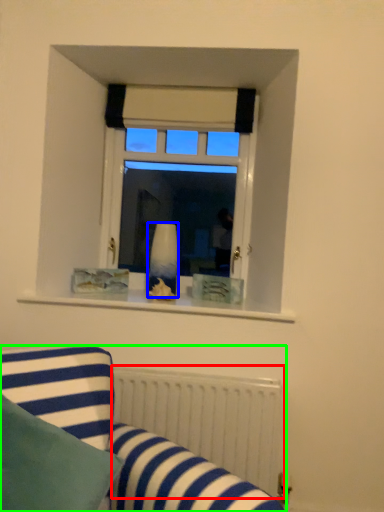
Question: Which is nearer to the radiator (highlighted by a red box)? vase (highlighted by a blue box) or studio couch (highlighted by a green box).

Choices:
 (A) vase
 (B) studio couch

Answer: (B)